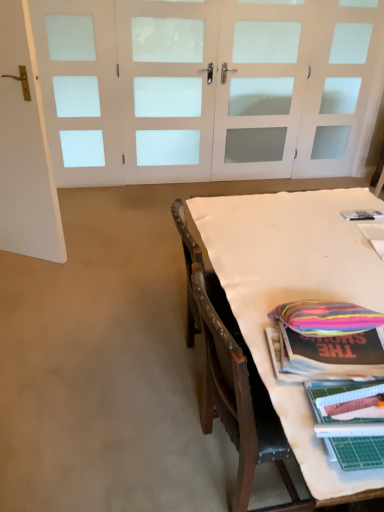
Question: Is white fabric-covered table at lower right surrounded by white frosted glass door at upper center, the first door when ordered from back to front?

Choices:
 (A) yes
 (B) no

Answer: (B)

Question: Can you confirm if white frosted glass door at upper center, the first door when ordered from back to front, is smaller than white fabric-covered table at lower right?

Choices:
 (A) yes
 (B) no

Answer: (A)

Question: Considering the relative sizes of white frosted glass door at upper center, which is the second door from front to back, and white fabric-covered table at lower right in the image provided, is white frosted glass door at upper center, which is the second door from front to back, shorter than white fabric-covered table at lower right?

Choices:
 (A) no
 (B) yes

Answer: (A)

Question: Is white frosted glass door at upper center, the first door when ordered from back to front, bigger than white fabric-covered table at lower right?

Choices:
 (A) no
 (B) yes

Answer: (A)

Question: Does white frosted glass door at upper center, the first door when ordered from back to front, come behind white fabric-covered table at lower right?

Choices:
 (A) yes
 (B) no

Answer: (A)

Question: Looking at their shapes, would you say white fabric-covered table at lower right is wider or thinner than white frosted glass door at upper center, the second door positioned from the left?

Choices:
 (A) thin
 (B) wide

Answer: (B)

Question: Is point (299, 265) closer or farther from the camera than point (150, 20)?

Choices:
 (A) closer
 (B) farther

Answer: (A)

Question: Is white fabric-covered table at lower right bigger or smaller than white frosted glass door at upper center, which is the second door from front to back?

Choices:
 (A) small
 (B) big

Answer: (B)

Question: Based on their positions, is white fabric-covered table at lower right located to the left or right of white frosted glass door at upper center, the second door positioned from the left?

Choices:
 (A) right
 (B) left

Answer: (A)

Question: From the image's perspective, is white fabric-covered table at lower right above or below white matte door at left, placed as the 2th door when sorted from right to left?

Choices:
 (A) above
 (B) below

Answer: (B)

Question: Is point (360, 288) positioned closer to the camera than point (28, 49)?

Choices:
 (A) farther
 (B) closer

Answer: (B)

Question: Looking at the image, does white fabric-covered table at lower right seem bigger or smaller compared to white matte door at left, the 1th door in the left-to-right sequence?

Choices:
 (A) big
 (B) small

Answer: (A)

Question: From a real-world perspective, is white fabric-covered table at lower right positioned above or below white matte door at left, positioned as the second door in back-to-front order?

Choices:
 (A) below
 (B) above

Answer: (A)

Question: Looking at the image, does white matte door at left, placed as the 1th door when sorted from front to back, seem bigger or smaller compared to white frosted glass door at upper center, which is the second door from front to back?

Choices:
 (A) big
 (B) small

Answer: (A)

Question: From a real-world perspective, relative to white frosted glass door at upper center, which is the second door from front to back, is white matte door at left, the 1th door in the left-to-right sequence, vertically above or below?

Choices:
 (A) below
 (B) above

Answer: (A)